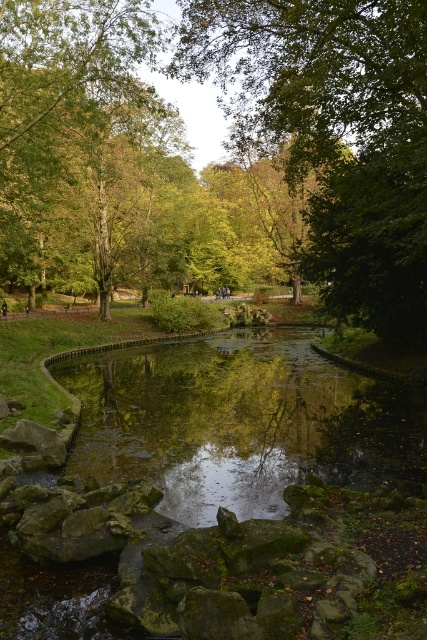
You are standing in the park and see the green reflective water at center and the dark brown leather jacket at center. Which object is taller?

The dark brown leather jacket at center is taller than the green reflective water at center.

You are standing in the park and see the green reflective water at center and the dark brown leather jacket at center. Which object is positioned to the right of the other?

The green reflective water at center is to the right of the dark brown leather jacket at center.

You are standing at the edge of the pond and want to locate the green leafy tree at center. Which direction should you look to find it?

The green leafy tree at center is located at point coordinates of 0.209 on the x axis and 0.785 on the y axis. Since the coordinate system starts at the bottom left corner of the image, the green leafy tree at center is positioned to the right and above the bottom left corner, so you should look towards the center of the image.